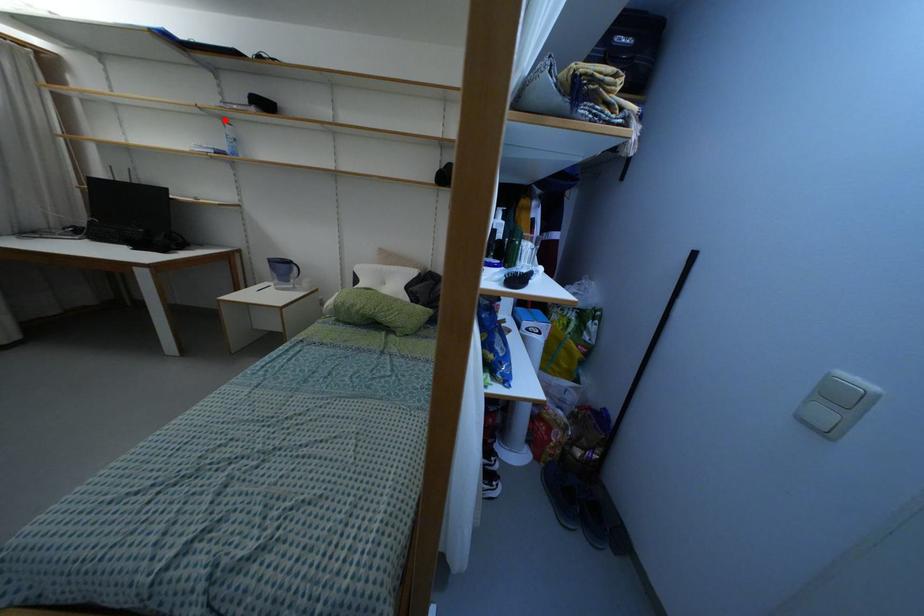
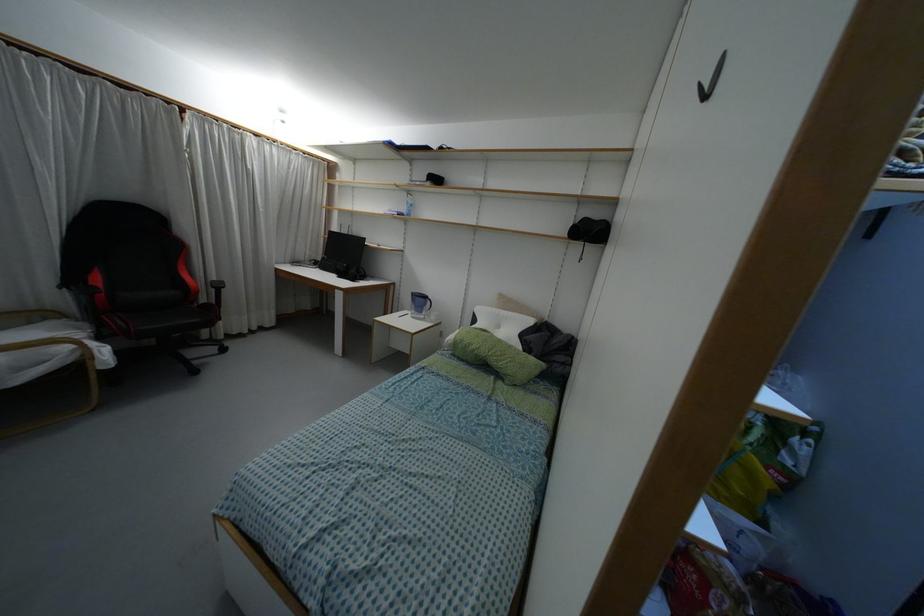
Question: I am providing you with two images of the same scene from different viewpoints. Given a red point in image1, look at the same physical point in image2. Is it:

Choices:
 (A) Closer to the viewpoint
 (B) Farther from the viewpoint

Answer: (A)